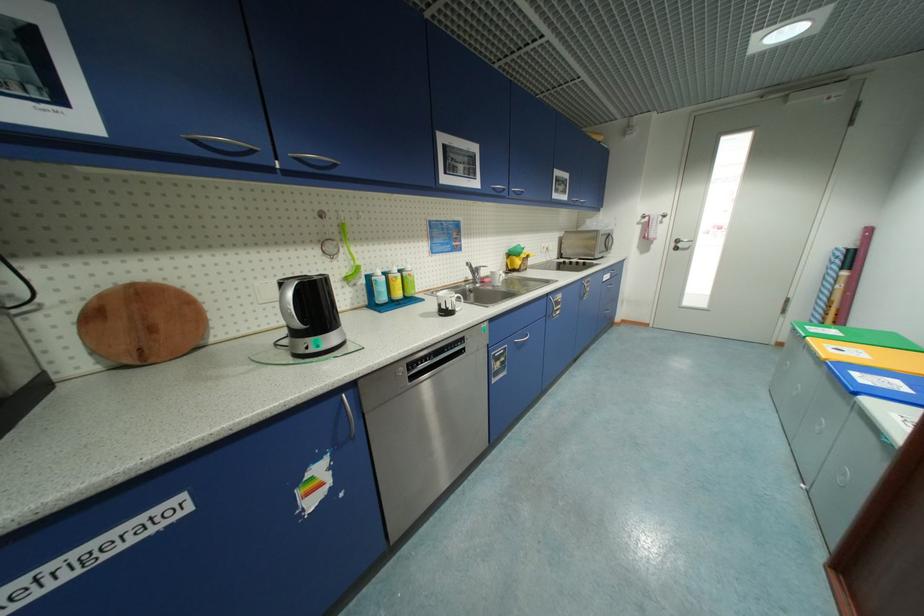
Find where to lift the yellow bin lid. Please return your answer as a coordinate pair (x, y).

(864, 353)